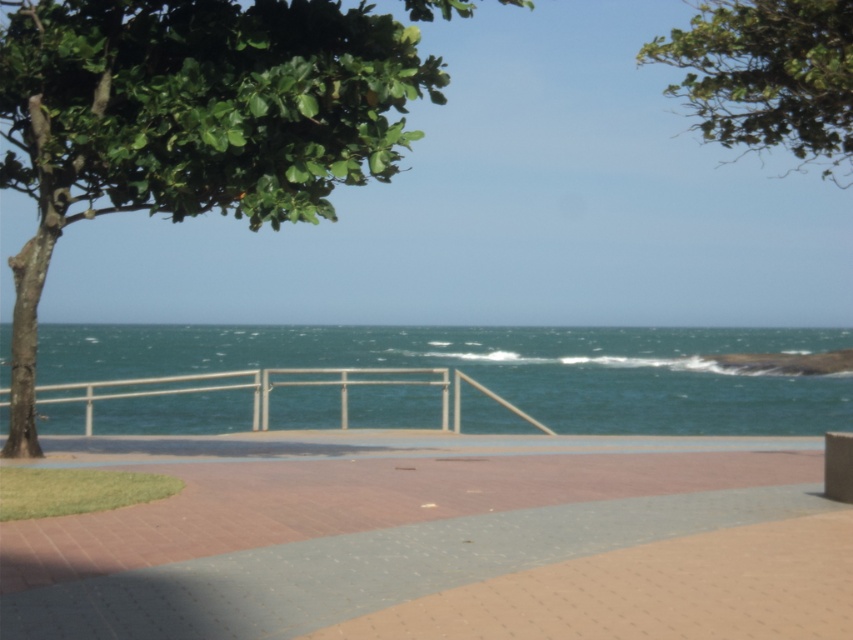
Can you confirm if teal glossy water at center is bigger than green leafy tree at upper center?

Incorrect, teal glossy water at center is not larger than green leafy tree at upper center.

Which of these two, teal glossy water at center or green leafy tree at upper center, stands shorter?

With less height is teal glossy water at center.

Which is in front, point (396, 392) or point (809, 136)?

Point (809, 136) is in front.

The height and width of the screenshot is (640, 853). In order to click on teal glossy water at center in this screenshot , I will do `click(506, 369)`.

Is point (64, 536) closer to viewer compared to point (775, 29)?

Yes, it is in front of point (775, 29).

Identify the location of brick paved path at center. The height and width of the screenshot is (640, 853). (364, 536).

Describe the element at coordinates (364, 536) in the screenshot. This screenshot has width=853, height=640. I see `brick paved path at center` at that location.

Who is positioned more to the right, brick paved path at center or white metal rail at center?

Positioned to the right is brick paved path at center.

The image size is (853, 640). I want to click on brick paved path at center, so (x=364, y=536).

Identify the location of brick paved path at center. (364, 536).